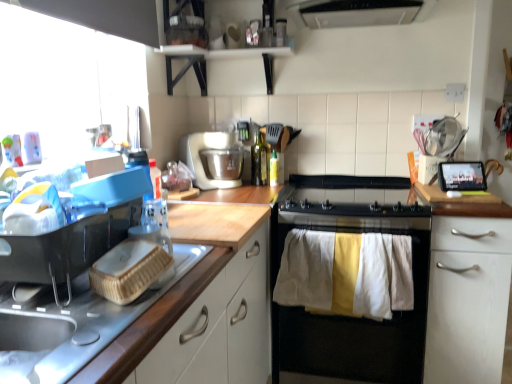
Question: From the image's perspective, is white plastic mixer at center above wooden countertop at left, which is the first cabinetry from left to right?

Choices:
 (A) no
 (B) yes

Answer: (B)

Question: From a real-world perspective, is white plastic mixer at center physically below wooden countertop at left, which is the first cabinetry from left to right?

Choices:
 (A) yes
 (B) no

Answer: (B)

Question: Can you confirm if white plastic mixer at center is positioned to the right of wooden countertop at left, the second cabinetry when ordered from back to front?

Choices:
 (A) no
 (B) yes

Answer: (B)

Question: From the image's perspective, is white plastic mixer at center under wooden countertop at left, which is the first cabinetry from left to right?

Choices:
 (A) yes
 (B) no

Answer: (B)

Question: Is white plastic mixer at center bigger than wooden countertop at left, the first cabinetry in the front-to-back sequence?

Choices:
 (A) no
 (B) yes

Answer: (A)

Question: Would you say wooden countertop at left, the second cabinetry when ordered from back to front, is part of white plastic mixer at center's contents?

Choices:
 (A) yes
 (B) no

Answer: (B)

Question: Is wooden countertop at left, the second cabinetry when ordered from back to front, located within black matte stove at center?

Choices:
 (A) no
 (B) yes

Answer: (A)

Question: Is black matte stove at center completely or partially outside of wooden countertop at left, the second cabinetry when ordered from back to front?

Choices:
 (A) yes
 (B) no

Answer: (A)

Question: Considering the relative positions of black matte stove at center and wooden countertop at left, the second cabinetry from the right, in the image provided, is black matte stove at center to the right of wooden countertop at left, the second cabinetry from the right, from the viewer's perspective?

Choices:
 (A) yes
 (B) no

Answer: (A)

Question: Does black matte stove at center have a lesser height compared to wooden countertop at left, the first cabinetry in the front-to-back sequence?

Choices:
 (A) no
 (B) yes

Answer: (A)

Question: Does black matte stove at center have a greater height compared to wooden countertop at left, the second cabinetry from the right?

Choices:
 (A) no
 (B) yes

Answer: (B)

Question: Does black matte stove at center have a larger size compared to wooden countertop at left, the second cabinetry when ordered from back to front?

Choices:
 (A) no
 (B) yes

Answer: (B)

Question: From the image's perspective, is white plastic mixer at center located beneath black matte stove at center?

Choices:
 (A) yes
 (B) no

Answer: (B)